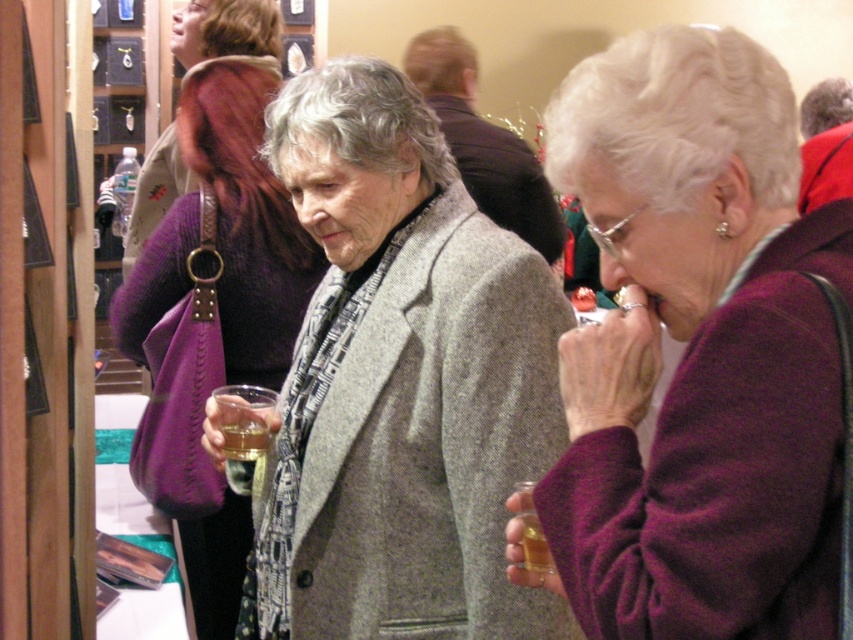
Question: Which point is farther from the camera taking this photo?

Choices:
 (A) (251, 480)
 (B) (529, 483)
 (C) (155, 221)
 (D) (250, 308)

Answer: (C)

Question: Which object is the farthest from the translucent glass bottle at lower center?

Choices:
 (A) matte gray coat at center
 (B) gray woolen coat at center

Answer: (A)

Question: Does purple wool sweater at right have a larger size compared to purple fabric purse at upper left?

Choices:
 (A) yes
 (B) no

Answer: (B)

Question: Can you confirm if purple wool sweater at right is positioned below purple fabric purse at upper left?

Choices:
 (A) yes
 (B) no

Answer: (A)

Question: Is matte gray coat at center thinner than translucent glass at center?

Choices:
 (A) yes
 (B) no

Answer: (B)

Question: Which object is the farthest from the gray woolen coat at center?

Choices:
 (A) matte gray coat at center
 (B) translucent glass bottle at lower center
 (C) purple wool sweater at right

Answer: (A)